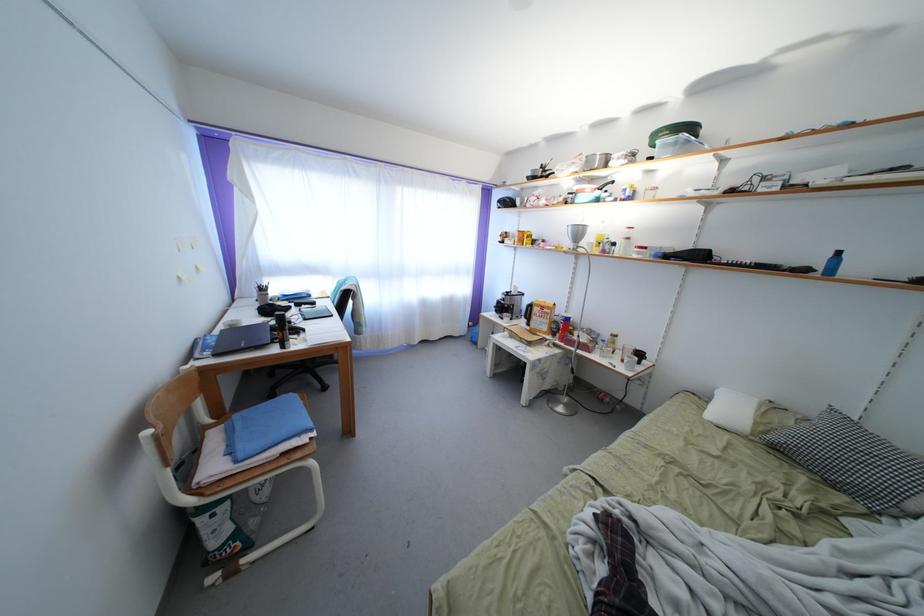
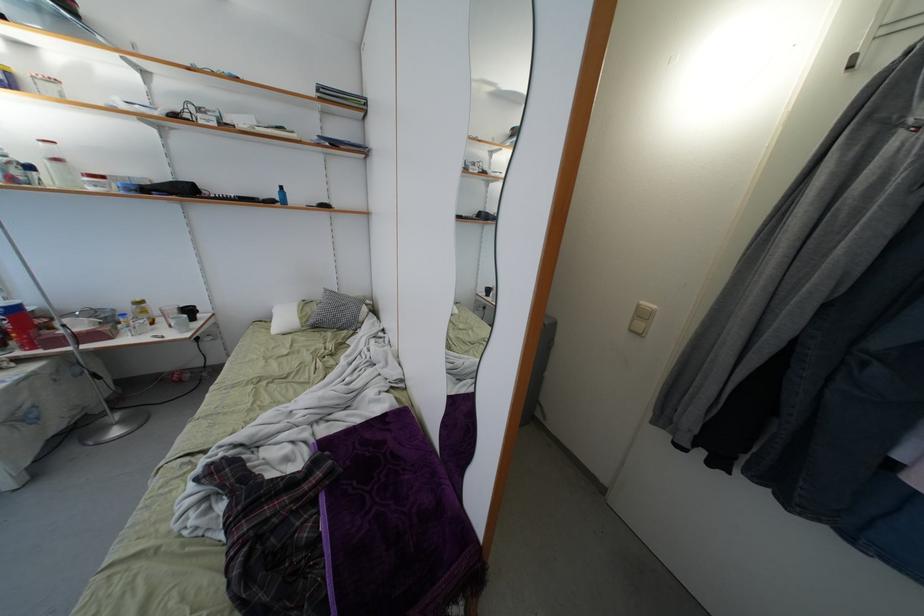
Where in the second image is the point corresponding to the point at 568,334 from the first image?

(22, 333)